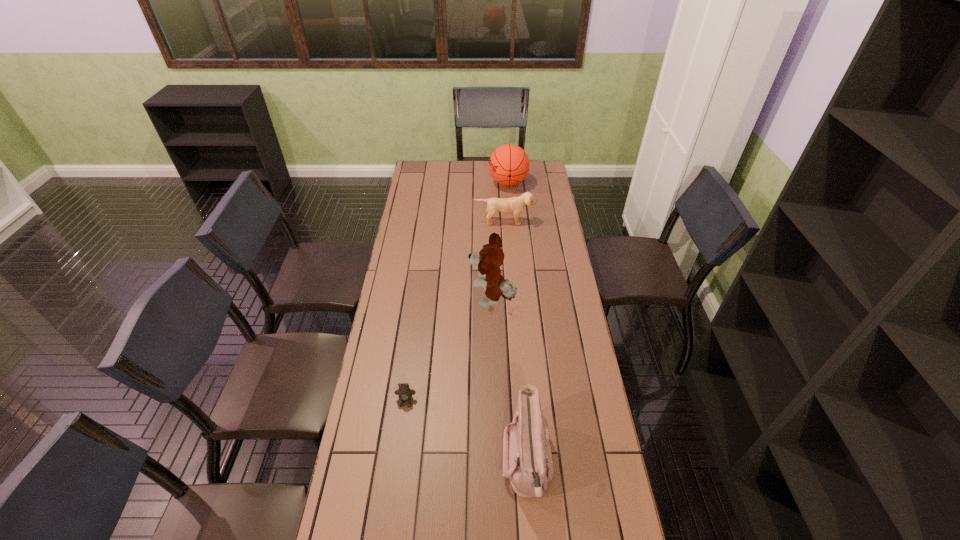
Where is `object that is at the far edge`? This screenshot has width=960, height=540. object that is at the far edge is located at coordinates (509, 164).

Find the location of a particular element. The height and width of the screenshot is (540, 960). object that is at the left edge is located at coordinates (404, 393).

Where is `basketball situated at the right edge`? The width and height of the screenshot is (960, 540). basketball situated at the right edge is located at coordinates (509, 164).

The width and height of the screenshot is (960, 540). I want to click on puppy located in the right edge section of the desktop, so click(x=515, y=205).

Where is `object present at the far right corner`? This screenshot has height=540, width=960. object present at the far right corner is located at coordinates (509, 164).

Where is `vacant space at the left edge`? This screenshot has width=960, height=540. vacant space at the left edge is located at coordinates (433, 214).

The height and width of the screenshot is (540, 960). What are the coordinates of `vacant area at the right edge of the desktop` in the screenshot? It's located at (559, 219).

Locate an element on the screen. free spot between the fourth farthest object and the nearer puppy is located at coordinates (449, 350).

This screenshot has width=960, height=540. I want to click on free space between the teddy bear and the shoulder bag, so click(467, 432).

Find the location of a particular element. The width and height of the screenshot is (960, 540). vacant point located between the leftmost object and the nearest object is located at coordinates (467, 432).